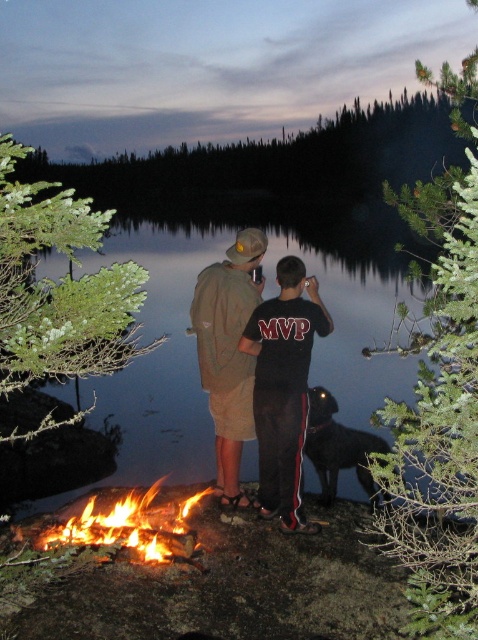
Question: Which point is closer to the camera taking this photo?

Choices:
 (A) (323, 445)
 (B) (143, 554)

Answer: (B)

Question: Can you confirm if glossy reflective water at center is positioned below flaming wood fire at lower left?

Choices:
 (A) no
 (B) yes

Answer: (A)

Question: Which point is closer to the camera?

Choices:
 (A) (372, 257)
 (B) (365, 433)

Answer: (B)

Question: Which object appears closest to the camera in this image?

Choices:
 (A) khaki cotton shorts at center
 (B) flaming wood fire at lower left
 (C) glossy reflective water at center
 (D) shiny black dog at lower center

Answer: (B)

Question: Does glossy reflective water at center appear on the left side of shiny black dog at lower center?

Choices:
 (A) yes
 (B) no

Answer: (A)

Question: Does khaki cotton shorts at center appear over flaming wood fire at lower left?

Choices:
 (A) yes
 (B) no

Answer: (A)